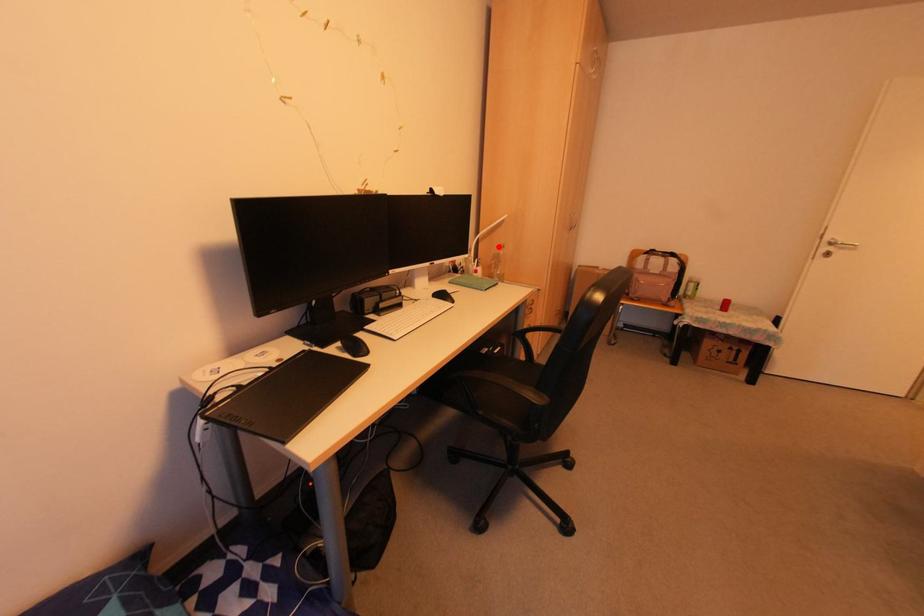
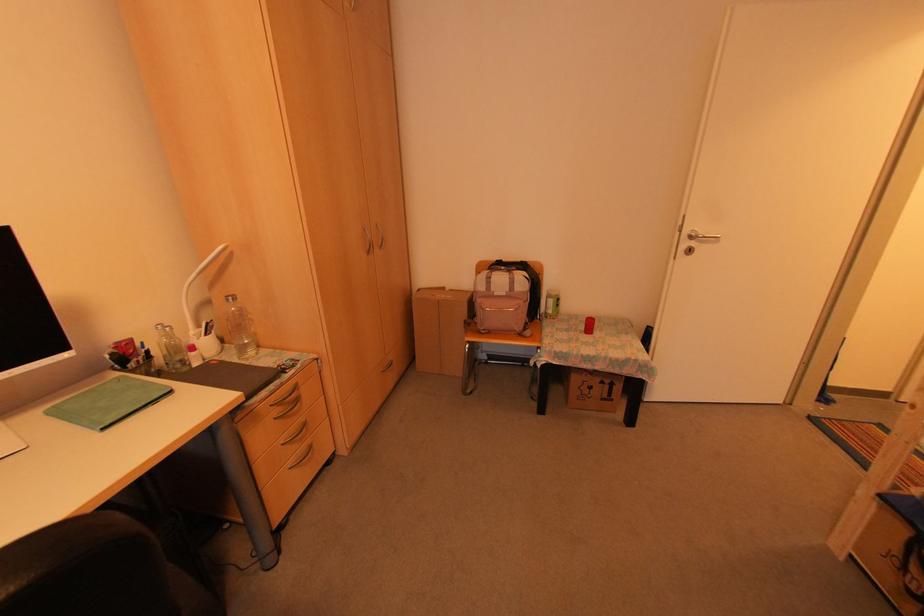
The point at the highlighted location is marked in the first image. Where is the corresponding point in the second image?

(225, 300)